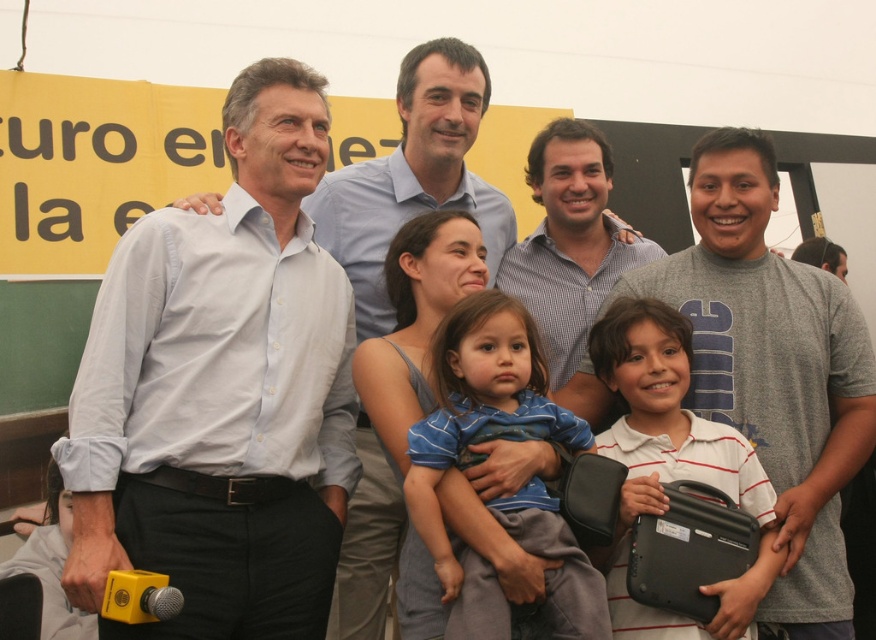
Which is behind, point (428, 192) or point (745, 524)?

The point (428, 192) is behind.

Consider the image. Between white shirt at center and black matte briefcase at lower right, which one is positioned higher?

Positioned higher is white shirt at center.

Is point (396, 557) closer to camera compared to point (636, 516)?

No.

Where is `white shirt at center`? white shirt at center is located at coordinates (413, 177).

Is white striped polo shirt at center taller than checkered shirt at center?

No.

Describe the element at coordinates (672, 467) in the screenshot. I see `white striped polo shirt at center` at that location.

Locate an element on the screen. This screenshot has width=876, height=640. white striped polo shirt at center is located at coordinates (672, 467).

Is light blue shirt at center wider than black matte briefcase at lower right?

Correct, the width of light blue shirt at center exceeds that of black matte briefcase at lower right.

Who is higher up, light blue shirt at center or black matte briefcase at lower right?

light blue shirt at center is higher up.

Identify the location of light blue shirt at center. This screenshot has height=640, width=876. (221, 392).